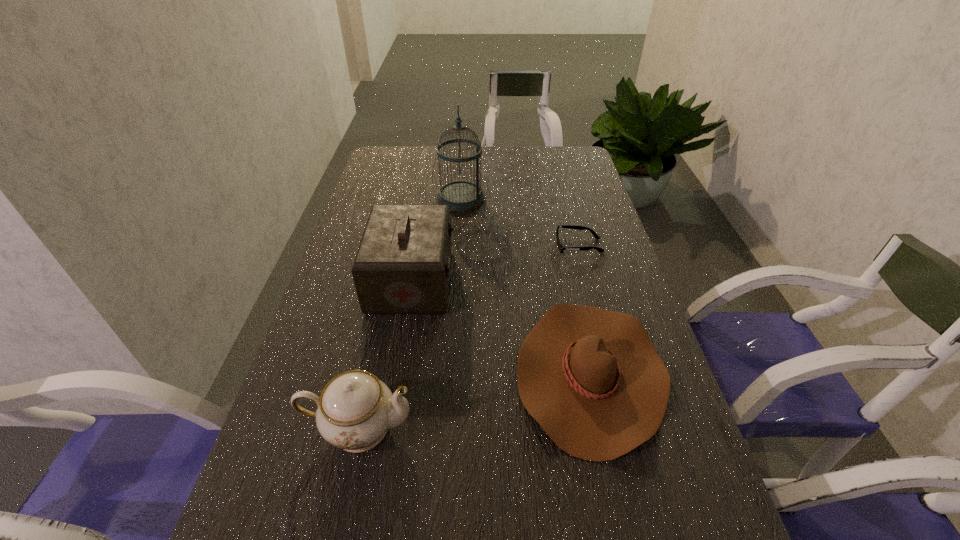
What are the coordinates of `the tallest object` in the screenshot? It's located at (461, 195).

Identify the location of the farthest object. (461, 195).

Find the location of a particular element. This screenshot has width=960, height=540. the first-aid kit is located at coordinates (402, 266).

This screenshot has width=960, height=540. Find the location of `chinaware`. chinaware is located at coordinates pyautogui.click(x=355, y=409).

Where is `cowboy hat`? Image resolution: width=960 pixels, height=540 pixels. cowboy hat is located at coordinates (592, 379).

The width and height of the screenshot is (960, 540). Identify the location of the shortest object. (560, 247).

At what (x,y) coordinates should I click in order to perform the action: click on free space located 0.080m on the front-facing side of the birdcage. Please return your answer as a coordinate pair (x, y). Looking at the image, I should click on coord(508,199).

Where is `vacant space located 0.180m on the right of the first-aid kit`? vacant space located 0.180m on the right of the first-aid kit is located at coordinates (520, 280).

Identify the location of vacant area located at the spout of the third shortest object. (474, 428).

At what (x,y) coordinates should I click in order to perform the action: click on free space located on the back of the second shortest object. Please return your answer as a coordinate pair (x, y). Looking at the image, I should click on (563, 248).